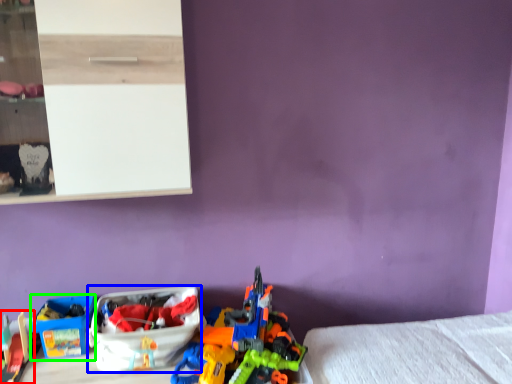
Question: Estimate the real-world distances between objects in this image. Which object is farther from toy (highlighted by a red box), storage box (highlighted by a blue box) or storage box (highlighted by a green box)?

Choices:
 (A) storage box
 (B) storage box

Answer: (A)